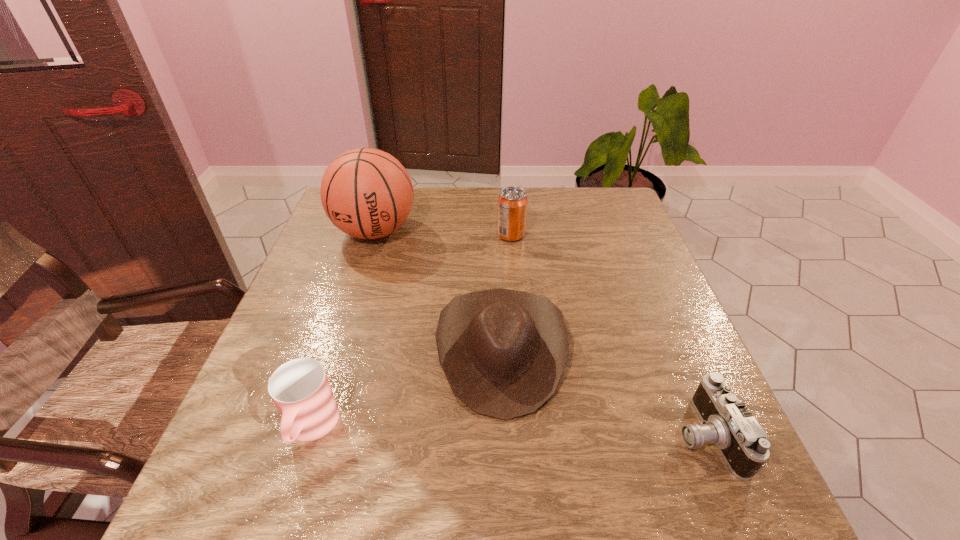
You are a GUI agent. You are given a task and a screenshot of the screen. Output one action in this format:
    pyautogui.click(x=<x>, y=<y>)
    Task: Click on the basketball
    
    Given the screenshot: What is the action you would take?
    pyautogui.click(x=367, y=193)

I want to click on soda can, so click(x=512, y=202).

I want to click on cup, so click(x=300, y=389).

Locate an element on the screen. This screenshot has height=540, width=960. cowboy hat is located at coordinates (503, 352).

You are a GUI agent. You are given a task and a screenshot of the screen. Output one action in this format:
    pyautogui.click(x=<x>, y=<y>)
    Task: Click on the rightmost object
    The image size is (960, 540).
    Given the screenshot: What is the action you would take?
    pyautogui.click(x=726, y=422)

Where is `camera`? camera is located at coordinates (726, 422).

This screenshot has width=960, height=540. Identify the location of free region located 0.140m on the surface of the tallest object near the brand logo. (355, 293).

Find the location of a particular element. The width and height of the screenshot is (960, 540). vacant space located 0.290m on the front of the soda can is located at coordinates (518, 319).

Find the location of a particular element. This screenshot has width=960, height=540. vacant space located 0.060m on the side of the cup with the handle is located at coordinates (287, 502).

At what (x,y) coordinates should I click in order to perform the action: click on free spot located 0.240m on the left of the cowboy hat. Please return your answer as a coordinate pair (x, y). This screenshot has height=540, width=960. Looking at the image, I should click on (324, 351).